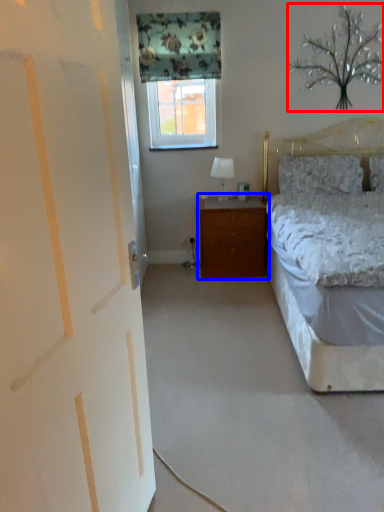
Question: Among these objects, which one is farthest to the camera, tree (highlighted by a red box) or nightstand (highlighted by a blue box)?

Choices:
 (A) tree
 (B) nightstand

Answer: (B)